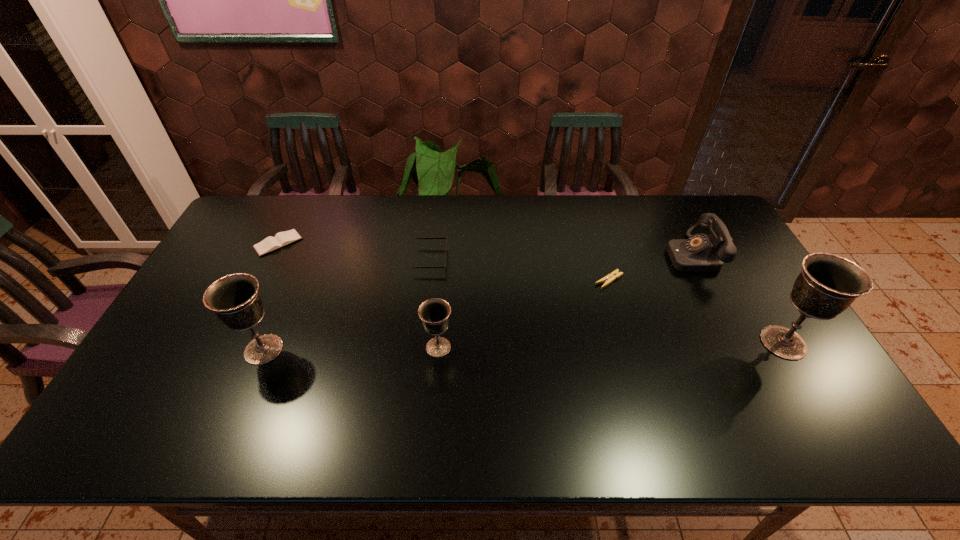
Select which object is the closest to the second chalice from left to right. Please provide its 2D coordinates. Your answer should be formatted as a tuple, i.e. [(x, y)], where the tuple contains the x and y coordinates of a point satisfying the conditions above.

[(446, 236)]

Identify the location of chalice that stands as the third closest to the telephone. This screenshot has width=960, height=540. (235, 299).

Where is `chalice object that ranks as the second closest to the sunglasses`? The height and width of the screenshot is (540, 960). chalice object that ranks as the second closest to the sunglasses is located at coordinates (235, 299).

The image size is (960, 540). I want to click on free spot that satisfies the following two spatial constraints: 1. on the dial of the telephone; 2. on the back side of the rightmost chalice, so click(734, 343).

At what (x,y) coordinates should I click in order to perform the action: click on vacant space that satisfies the following two spatial constraints: 1. on the front side of the rightmost chalice; 2. on the right side of the diary. Please return your answer as a coordinate pair (x, y). Looking at the image, I should click on (229, 343).

The image size is (960, 540). What are the coordinates of `free space that satisfies the following two spatial constraints: 1. on the front-facing side of the sunglasses; 2. on the right side of the second chalice from right to left` in the screenshot? It's located at (420, 347).